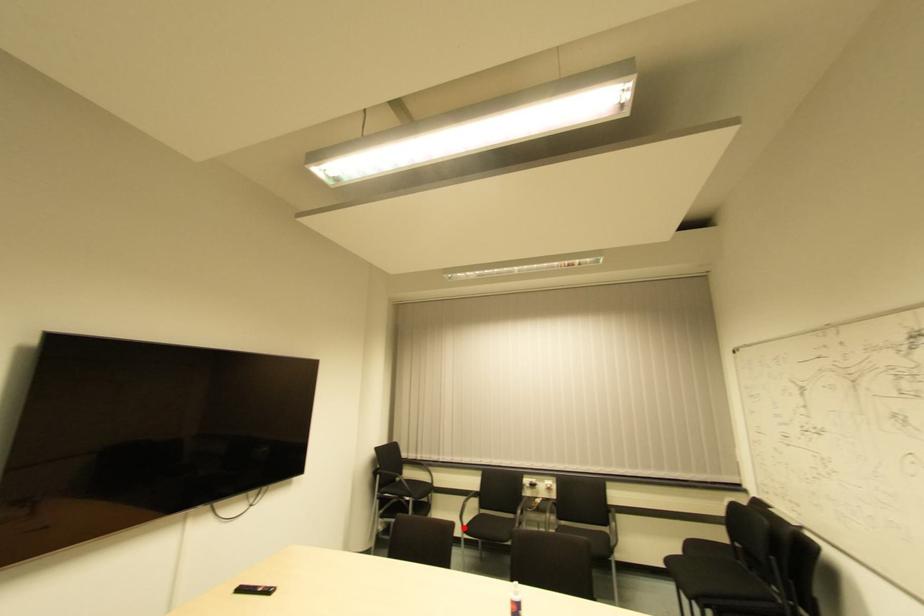
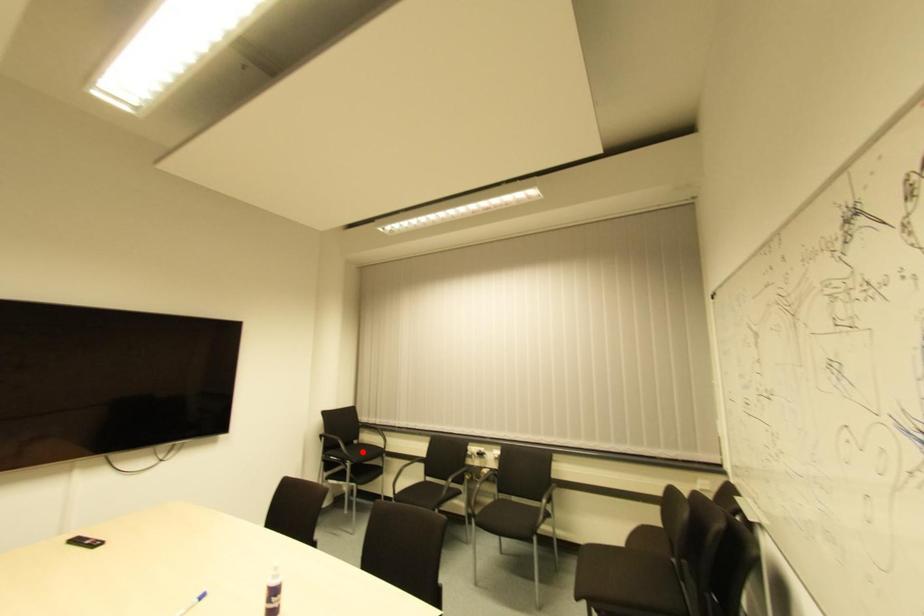
I am providing you with two images of the same scene from different viewpoints. A red point is marked on the first image and another point is marked on the second image. Do the highlighted points in image1 and image2 indicate the same real-world spot?

No